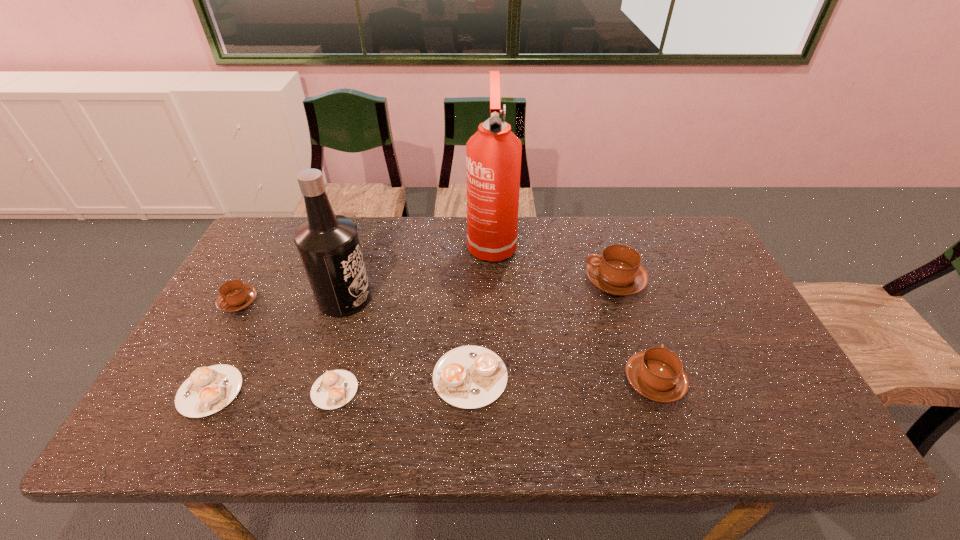
The height and width of the screenshot is (540, 960). In order to click on free space between the smallest white cappuccino and the red fire extinguisher in this screenshot , I will do `click(413, 316)`.

Identify the location of free space that is in between the seventh shortest object and the fire extinguisher. This screenshot has width=960, height=540. (418, 271).

Find the location of `free spot between the tallest cappuccino and the liquor`. free spot between the tallest cappuccino and the liquor is located at coordinates (480, 289).

What are the coordinates of `free space between the leftmost brown cappuccino and the nearest brown cappuccino` in the screenshot? It's located at point(446,341).

Locate which object ranks fifth in proximity to the leftmost brown cappuccino. Please provide its 2D coordinates. Your answer should be formatted as a tuple, i.e. [(x, y)], where the tuple contains the x and y coordinates of a point satisfying the conditions above.

[(493, 154)]

The image size is (960, 540). I want to click on the second closest object to the smallest brown cappuccino, so click(x=328, y=244).

Find the location of a particular element. The height and width of the screenshot is (540, 960). cappuccino that is the sixth closest to the black liquor is located at coordinates (657, 374).

Locate which cappuccino is the second closest to the fifth shortest cappuccino. Please provide its 2D coordinates. Your answer should be formatted as a tuple, i.e. [(x, y)], where the tuple contains the x and y coordinates of a point satisfying the conditions above.

[(469, 377)]

At what (x,y) coordinates should I click in order to perform the action: click on brown cappuccino that is the second closest to the leftmost brown cappuccino. Please return your answer as a coordinate pair (x, y). This screenshot has width=960, height=540. Looking at the image, I should click on (657, 374).

Identify which brown cappuccino is located as the third nearest to the fourth tallest cappuccino. Please provide its 2D coordinates. Your answer should be formatted as a tuple, i.e. [(x, y)], where the tuple contains the x and y coordinates of a point satisfying the conditions above.

[(235, 296)]